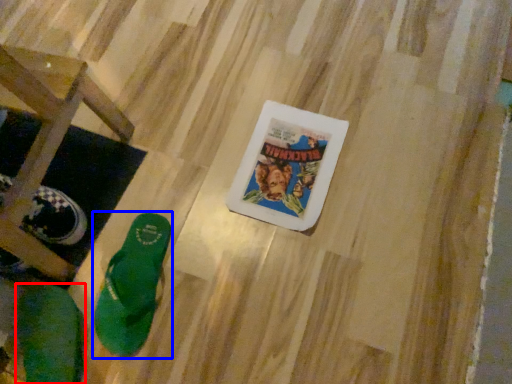
Question: Which of the following is the farthest to the observer, footwear (highlighted by a red box) or footwear (highlighted by a blue box)?

Choices:
 (A) footwear
 (B) footwear

Answer: (B)